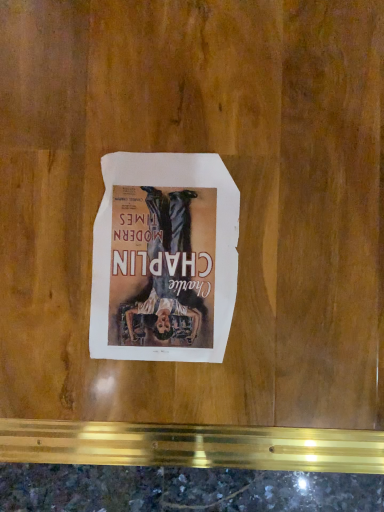
Locate an element on the screen. The width and height of the screenshot is (384, 512). white paper poster at center is located at coordinates (164, 258).

Describe the element at coordinates (164, 258) in the screenshot. I see `white paper poster at center` at that location.

Where is `white paper poster at center`? This screenshot has height=512, width=384. white paper poster at center is located at coordinates (164, 258).